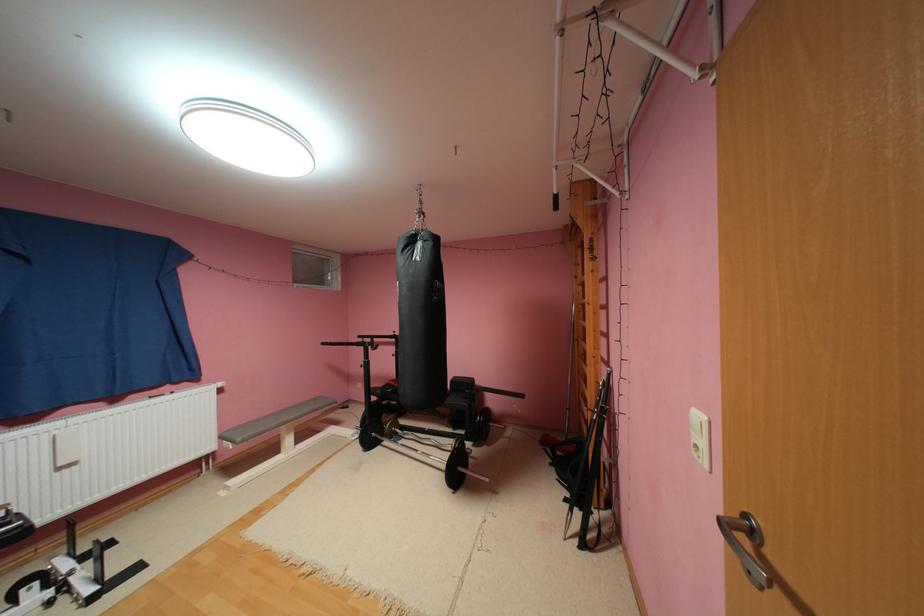
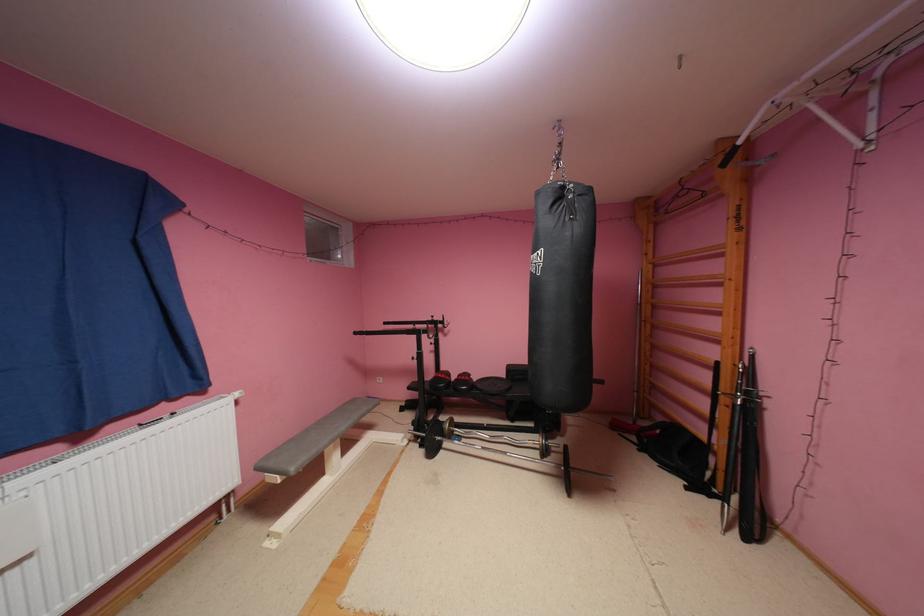
What movement of the cameraman would produce the second image?

The movement direction of the cameraman is left, forward.